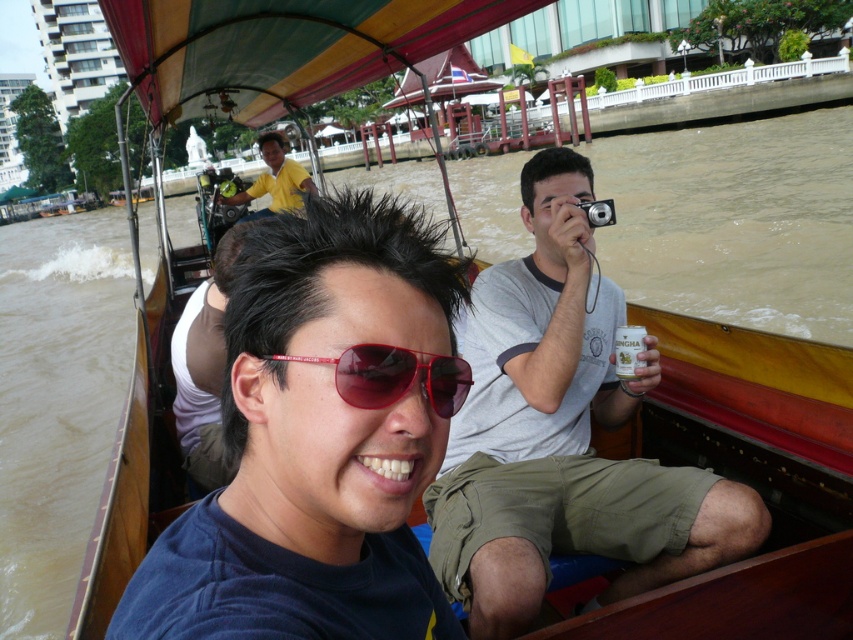
You are a photographer on the boat and want to take a photo of both the matte black sunglasses at center and the yellow shirt at center. Which object should you position on the right side of your camera frame?

You should position the matte black sunglasses at center on the right side of your camera frame since it is already to the right of the yellow shirt at center in the scene.

You are a photographer on the boat and want to take a photo of both the matte black sunglasses at center and the yellow shirt at center. Which object should you focus on first to ensure both are in the frame?

You should focus on the matte black sunglasses at center first because it is in front of the yellow shirt at center, so by focusing on the closer object, both will be in the frame.